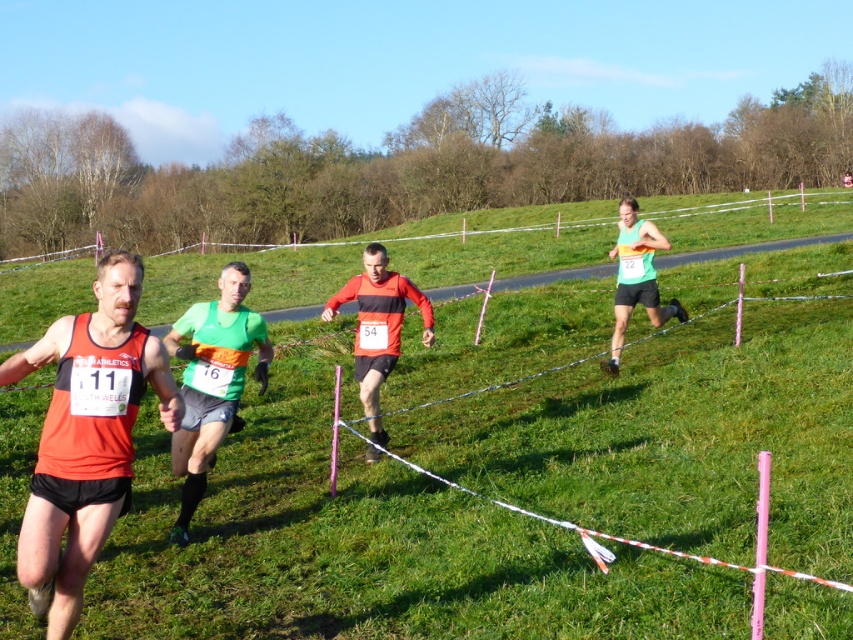
Question: Which object is the farthest from the green fabric shorts at center?

Choices:
 (A) green grassy at center
 (B) matte orange singlet at left
 (C) rainbow jersey runner at right

Answer: (A)

Question: Is green fabric shorts at center further to the viewer compared to matte red running shirt at center?

Choices:
 (A) yes
 (B) no

Answer: (B)

Question: Which of these objects is positioned farthest from the matte orange singlet at left?

Choices:
 (A) green fabric shorts at center
 (B) green grassy at center

Answer: (B)

Question: Can you confirm if green grassy at center is smaller than matte red running shirt at center?

Choices:
 (A) yes
 (B) no

Answer: (B)

Question: Which of the following is the closest to the observer?

Choices:
 (A) matte red running shirt at center
 (B) rainbow jersey runner at right
 (C) green grassy at center
 (D) matte orange singlet at left

Answer: (D)

Question: Is matte orange singlet at left further to the viewer compared to green fabric shorts at center?

Choices:
 (A) no
 (B) yes

Answer: (A)